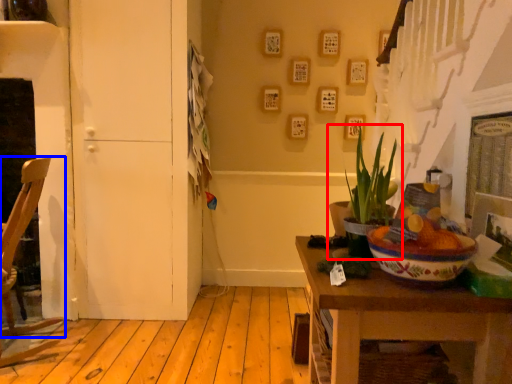
Question: Which object appears farthest to the camera in this image, houseplant (highlighted by a red box) or chair (highlighted by a blue box)?

Choices:
 (A) houseplant
 (B) chair

Answer: (B)